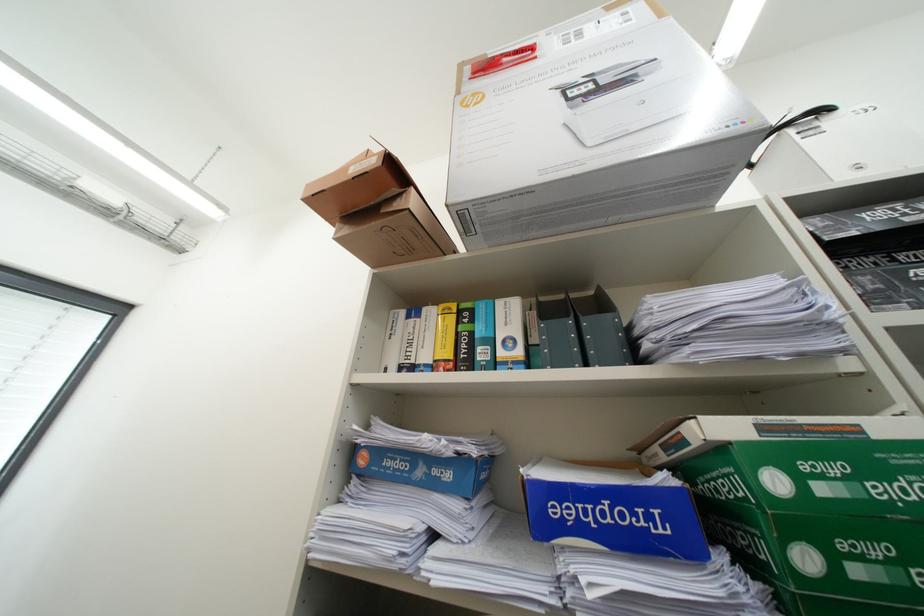
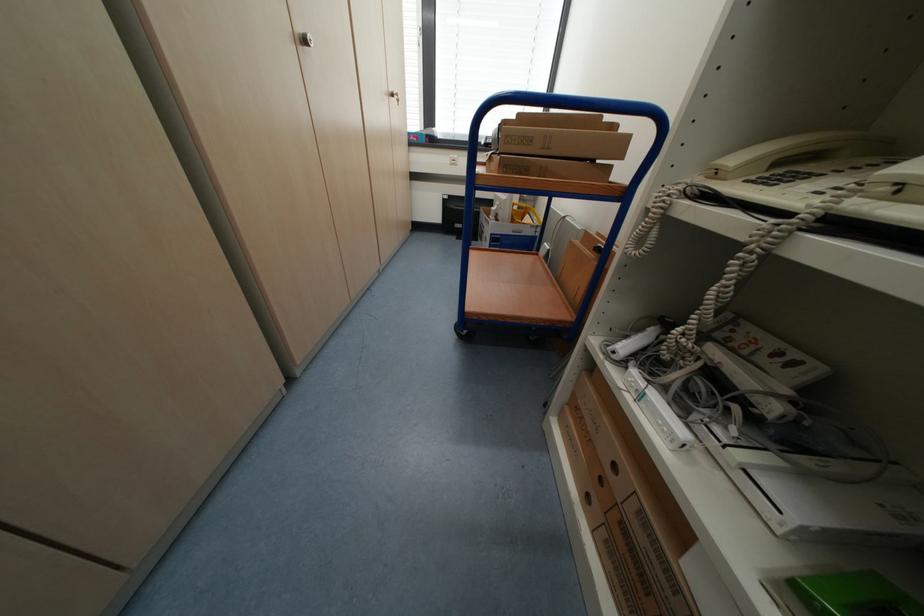
From the picture: Based on the continuous images, in which direction is the camera rotating?

The camera rotated toward left-down.